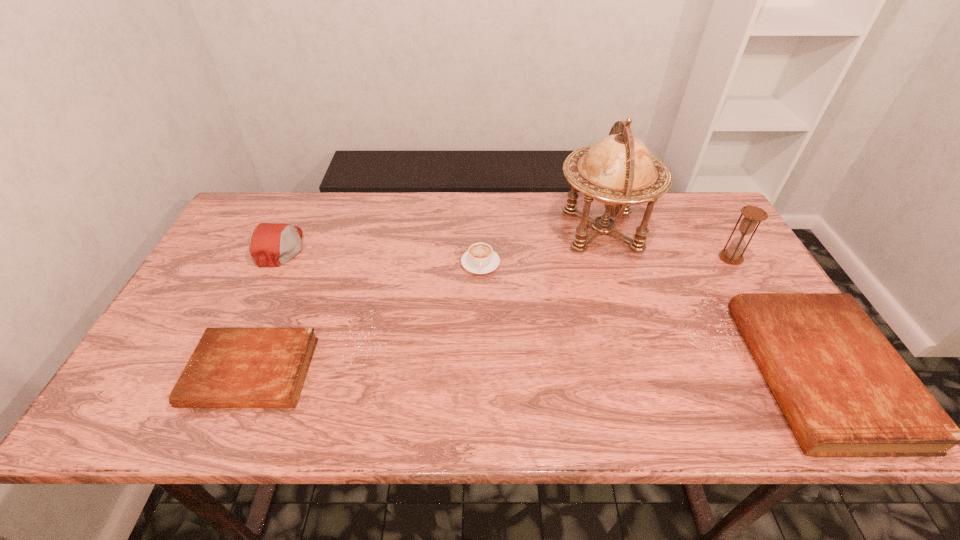
You are a GUI agent. You are given a task and a screenshot of the screen. Output one action in this format:
    pyautogui.click(x=<x>, y=<y>)
    Task: Click on the object that ranks as the closest to the left Bible
    This screenshot has height=540, width=960.
    Given the screenshot: What is the action you would take?
    pyautogui.click(x=270, y=244)

This screenshot has height=540, width=960. Identify the location of object that is the third closest to the second tallest object. (480, 258).

Locate an element on the screen. free space that satisfies the following two spatial constraints: 1. on the front-facing side of the second tallest object; 2. on the right side of the cap is located at coordinates (275, 258).

Image resolution: width=960 pixels, height=540 pixels. Identify the location of free location that satisfies the following two spatial constraints: 1. on the front-facing side of the fourth shortest object; 2. on the left side of the hourglass. (275, 258).

Find the location of `free space that satisfies the following two spatial constraints: 1. on the front-facing side of the globe; 2. on the spine side of the shorter Bible`. free space that satisfies the following two spatial constraints: 1. on the front-facing side of the globe; 2. on the spine side of the shorter Bible is located at coordinates (646, 373).